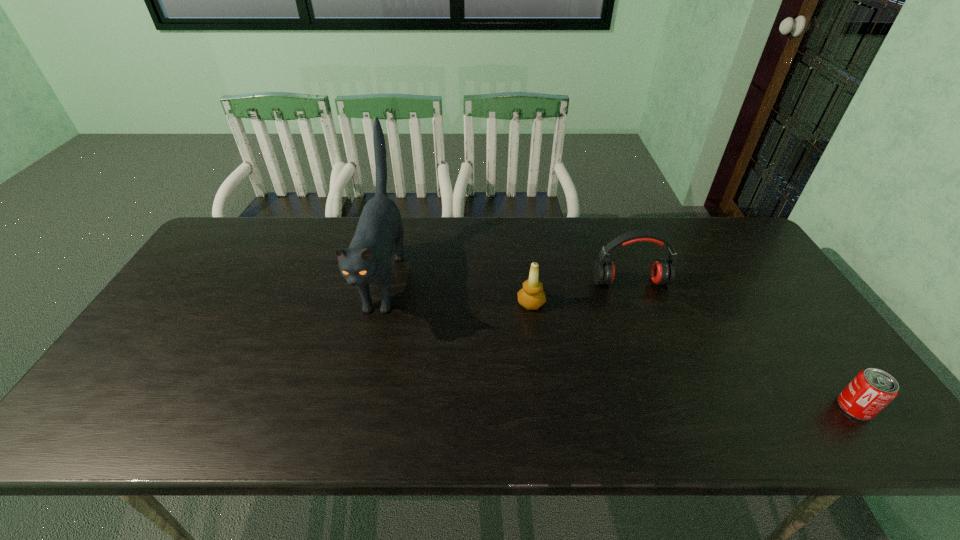
The width and height of the screenshot is (960, 540). Find the location of `cat`. cat is located at coordinates (367, 260).

The width and height of the screenshot is (960, 540). In order to click on the leftmost object in this screenshot , I will do [367, 260].

Where is `the third shortest object`? This screenshot has width=960, height=540. the third shortest object is located at coordinates (663, 270).

In order to click on earphone in this screenshot , I will do `click(663, 270)`.

Where is `the second shortest object`? This screenshot has width=960, height=540. the second shortest object is located at coordinates (531, 296).

Find the location of `the second object from left to right`. the second object from left to right is located at coordinates (531, 296).

Find the location of `can`. can is located at coordinates (871, 390).

The width and height of the screenshot is (960, 540). I want to click on the rightmost object, so click(x=871, y=390).

Find the location of a particular element. vacant region located 0.130m at the face of the leftmost object is located at coordinates (358, 386).

Identify the location of vacant space situated on the ear cups of the second tallest object. (658, 356).